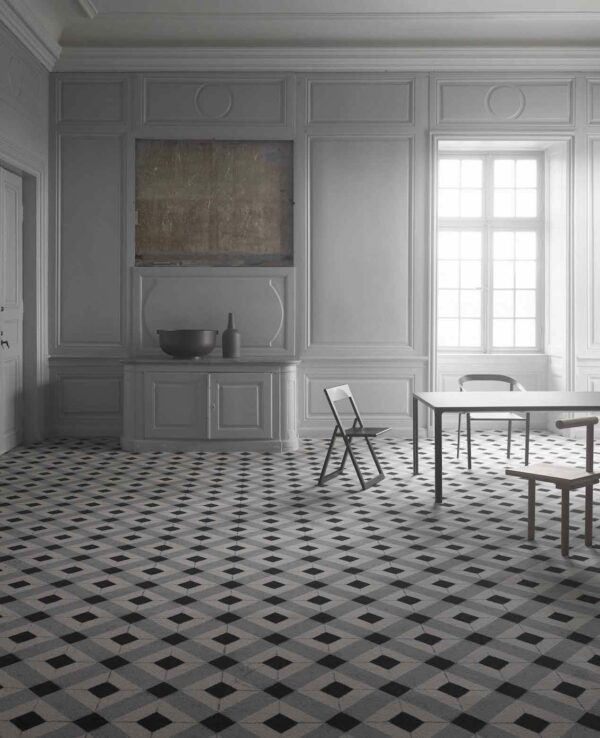
You are a GUI agent. You are given a task and a screenshot of the screen. Output one action in this format:
    pyautogui.click(x=<x>, y=<y>)
    Task: Click on the bowl
    This screenshot has width=600, height=738.
    Given the screenshot: What is the action you would take?
    pyautogui.click(x=187, y=342)